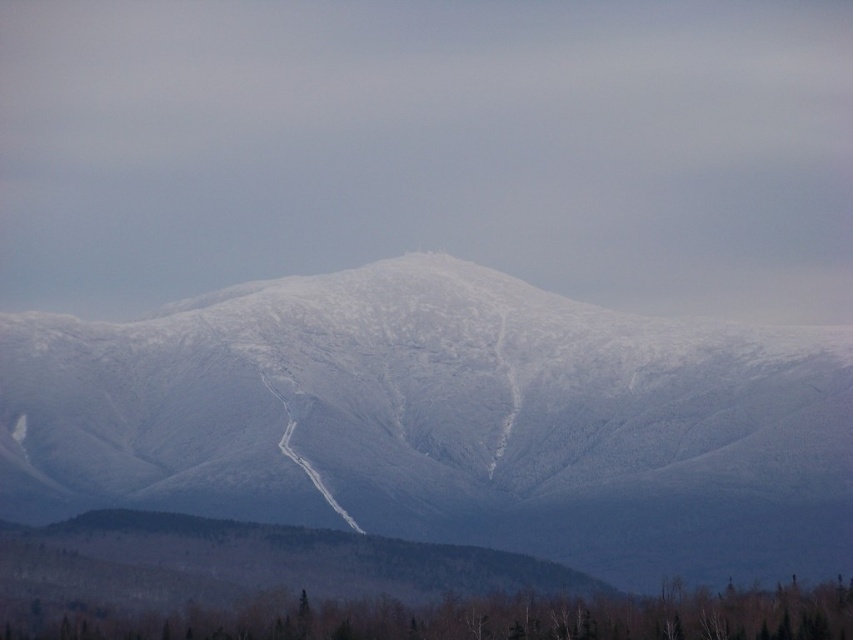
Question: Which of the following is the closest to the observer?

Choices:
 (A) coord(784,621)
 (B) coord(230,365)

Answer: (B)

Question: Observing the image, what is the correct spatial positioning of white snow-covered mountain at center in reference to green matte tree at lower center?

Choices:
 (A) left
 (B) right

Answer: (B)

Question: Which point is farther from the camera taking this photo?

Choices:
 (A) (643, 412)
 (B) (323, 618)

Answer: (A)

Question: Is white snow-covered mountain at center closer to the viewer compared to green matte tree at lower center?

Choices:
 (A) no
 (B) yes

Answer: (A)

Question: Can you confirm if white snow-covered mountain at center is positioned to the right of green matte tree at lower center?

Choices:
 (A) no
 (B) yes

Answer: (B)